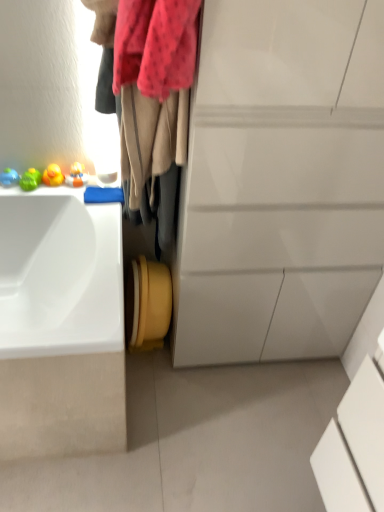
This screenshot has height=512, width=384. In order to click on vacant space in front of white glossy cabinet at center in this screenshot , I will do `click(236, 423)`.